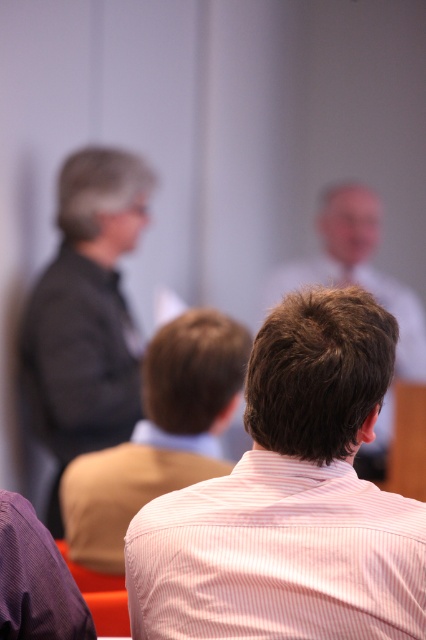
You are attending a conference and notice two people seated in front of you. One has a light brown shirt at center and the other has light brown hair at center. Which of these two features is positioned lower on their respective individuals?

The light brown shirt at center is below light brown hair at center, so the light brown shirt at center is positioned lower.

You are attending a conference and notice two people sitting in front of you. One has a light brown shirt at center and the other has light brown hair at center. Which of these two features is smaller in size?

The light brown shirt at center is smaller than the light brown hair at center.